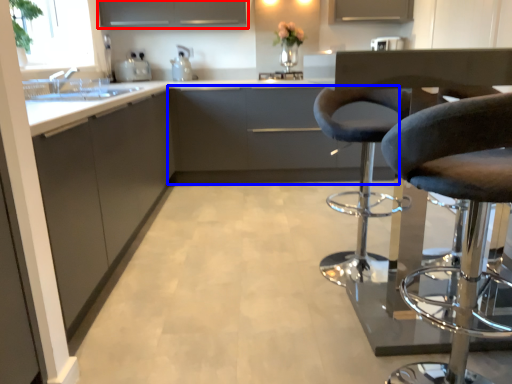
Question: Which object appears closest to the camera in this image, cabinetry (highlighted by a red box) or cabinetry (highlighted by a blue box)?

Choices:
 (A) cabinetry
 (B) cabinetry

Answer: (B)